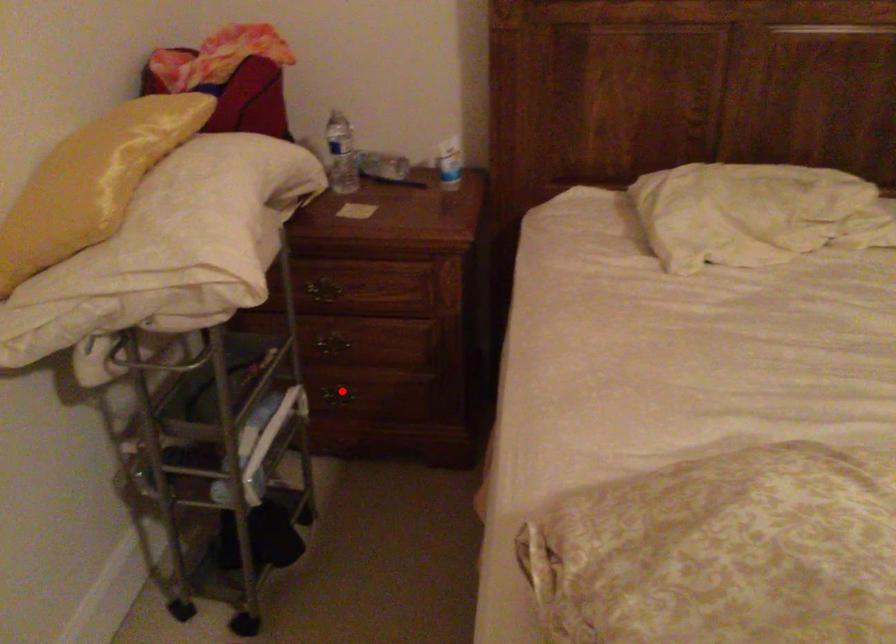
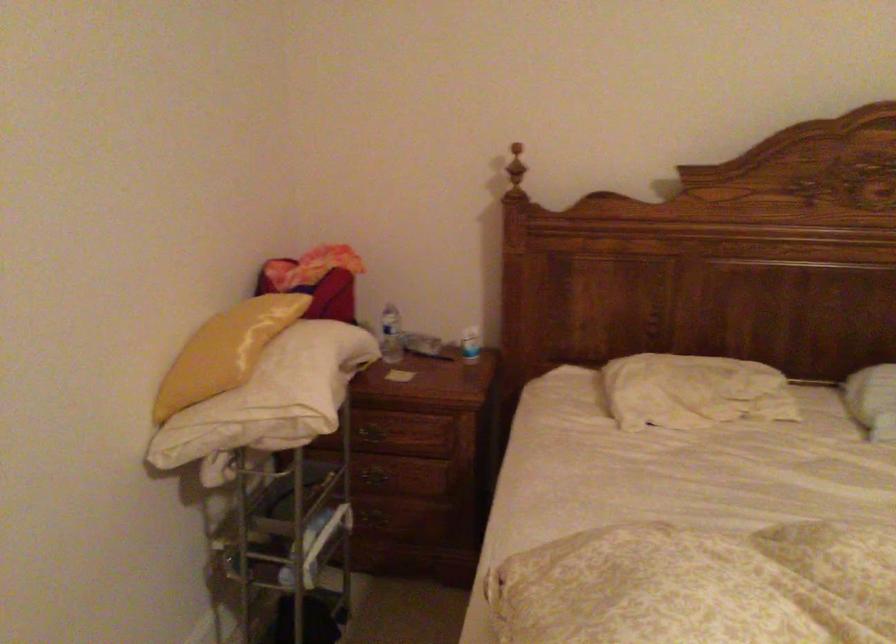
Where in the second image is the point corresponding to the highlighted location from the first image?

(381, 516)